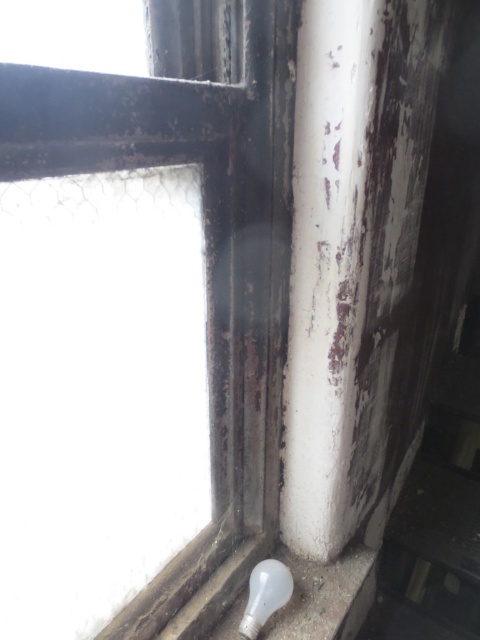
Measure the distance between rusty metal window frame at lower right and translucent glass bulb at lower right.

The distance of rusty metal window frame at lower right from translucent glass bulb at lower right is 14.11 inches.

Can you confirm if rusty metal window frame at lower right is bigger than translucent glass bulb at lower right?

Yes.

You are a GUI agent. You are given a task and a screenshot of the screen. Output one action in this format:
    pyautogui.click(x=<x>, y=<y>)
    Task: Click on the rusty metal window frame at lower right
    This screenshot has height=640, width=480.
    Given the screenshot: What is the action you would take?
    pyautogui.click(x=204, y=244)